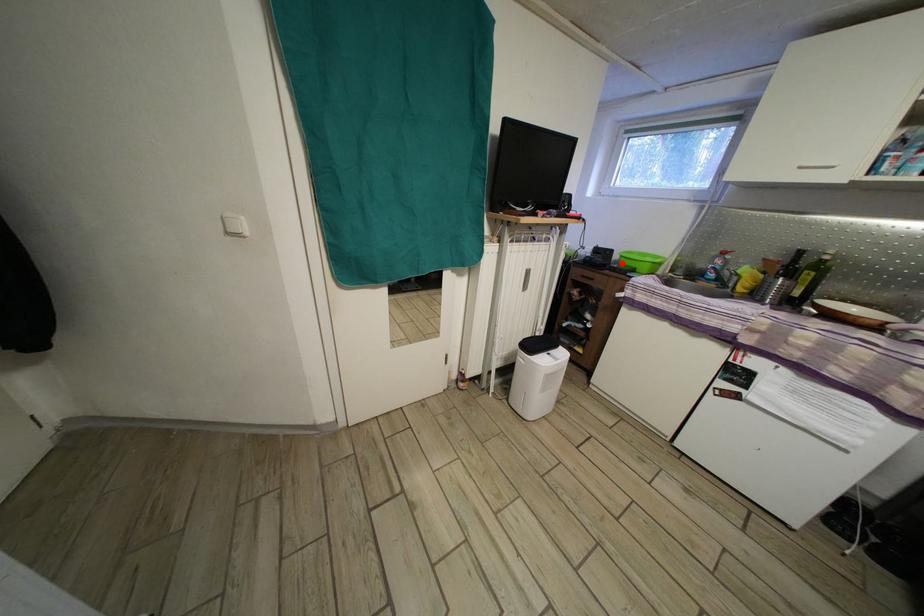
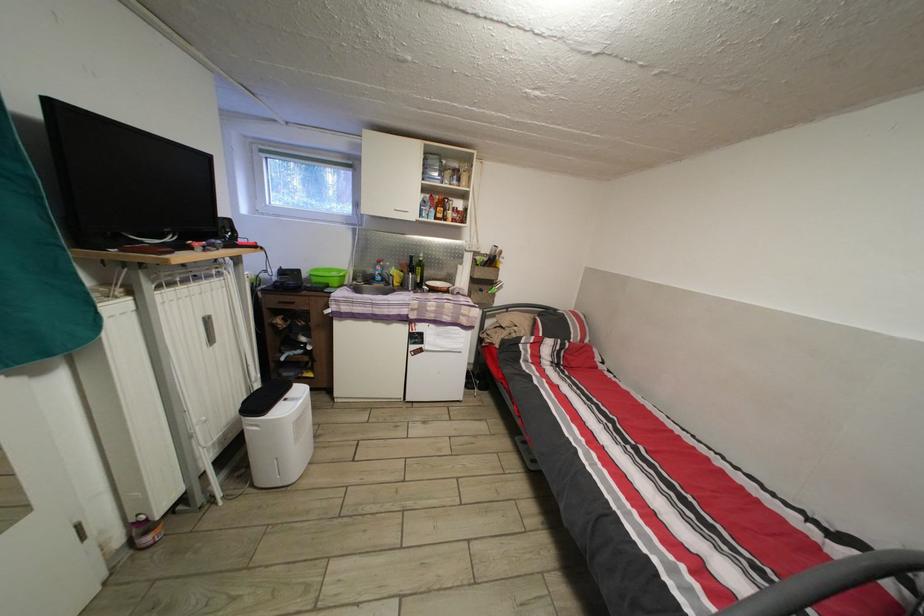
Find the pixel in the second image that matches the highlighted location in the first image.

(311, 282)